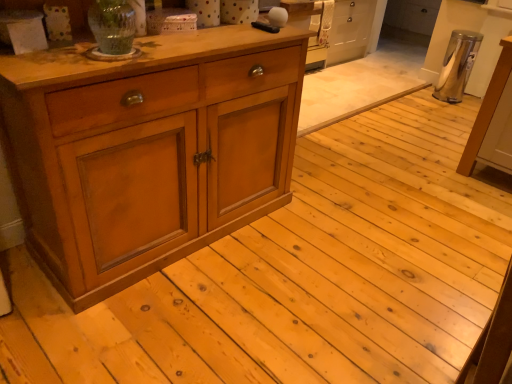
The image size is (512, 384). In order to click on vacant space to the right of matte wood cabinet at center in this screenshot , I will do `click(332, 249)`.